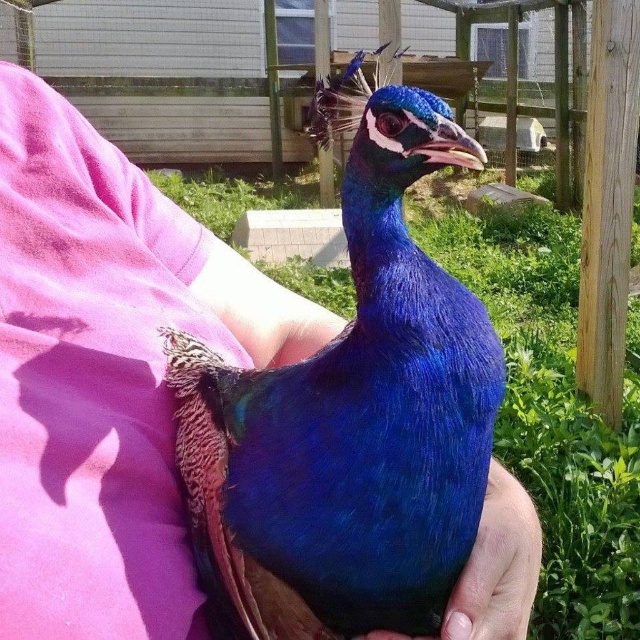
Question: Which object is farther from the camera taking this photo?

Choices:
 (A) satin blue feather at center
 (B) shiny blue peacock at center

Answer: (A)

Question: Can you confirm if shiny blue peacock at center is positioned below satin blue feather at center?

Choices:
 (A) no
 (B) yes

Answer: (A)

Question: Is shiny blue peacock at center above satin blue feather at center?

Choices:
 (A) yes
 (B) no

Answer: (A)

Question: Can you confirm if shiny blue peacock at center is wider than satin blue feather at center?

Choices:
 (A) no
 (B) yes

Answer: (B)